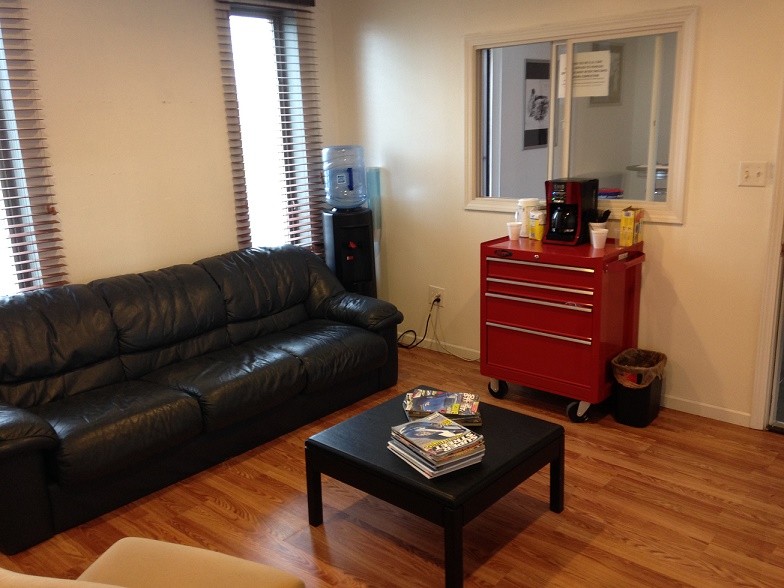
The image size is (784, 588). Find the location of `cup`. cup is located at coordinates (601, 230), (512, 225).